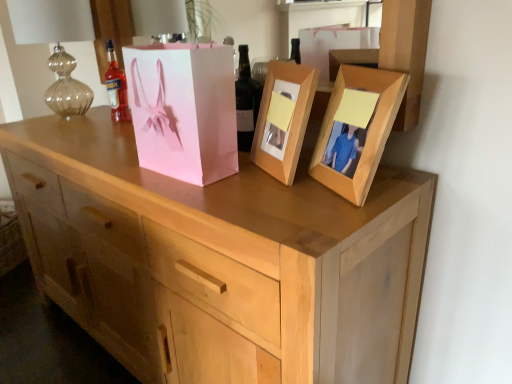
Where is `free space on the front side of dark brown glass bottle at center, the 2th bottle when ordered from left to right`? The width and height of the screenshot is (512, 384). free space on the front side of dark brown glass bottle at center, the 2th bottle when ordered from left to right is located at coordinates (249, 175).